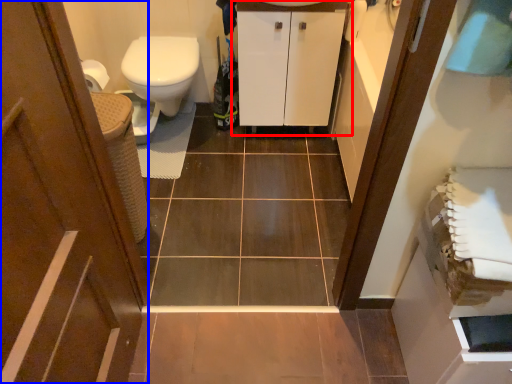
Question: Which object is closer to the camera taking this photo, bathroom cabinet (highlighted by a red box) or door (highlighted by a blue box)?

Choices:
 (A) bathroom cabinet
 (B) door

Answer: (B)